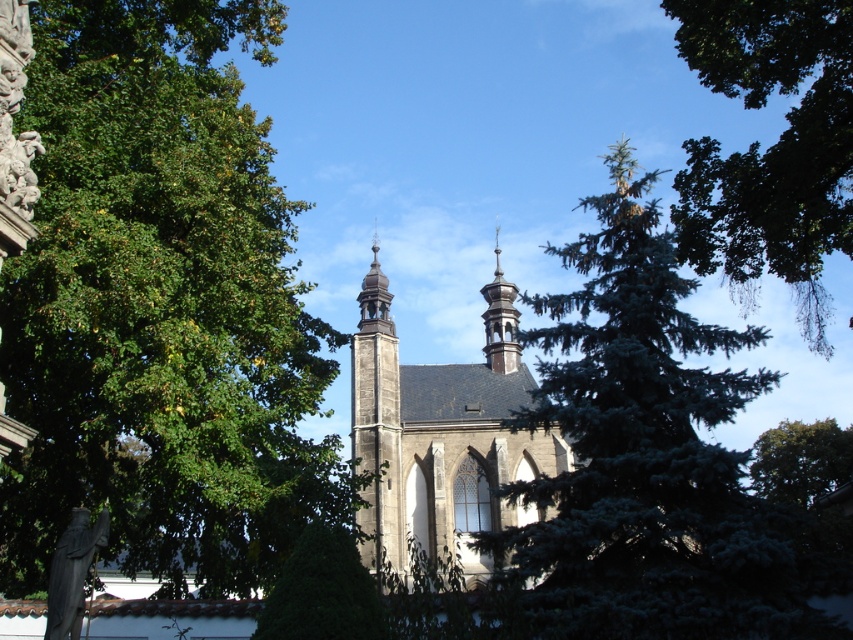
You are standing in front of the Gothic church and want to take a photo that includes both the church and the green leafy tree at upper right. Given that your camera has a maximum zoom range of 50 meters, will you be able to capture both in a single frame without moving closer?

The distance between the green leafy tree at upper right and the viewer is 61.16 meters, which exceeds the camera maximum zoom range of 50 meters. Therefore, you cannot capture both in a single frame without moving closer.

You are standing in front of the Gothic church and want to take a photo that includes the green leafy tree at upper right. Where should you position yourself relative to the church to ensure the tree is in the frame?

Position yourself to the lower left of the church so that the green leafy tree at upper right is visible in the upper right corner of your frame.